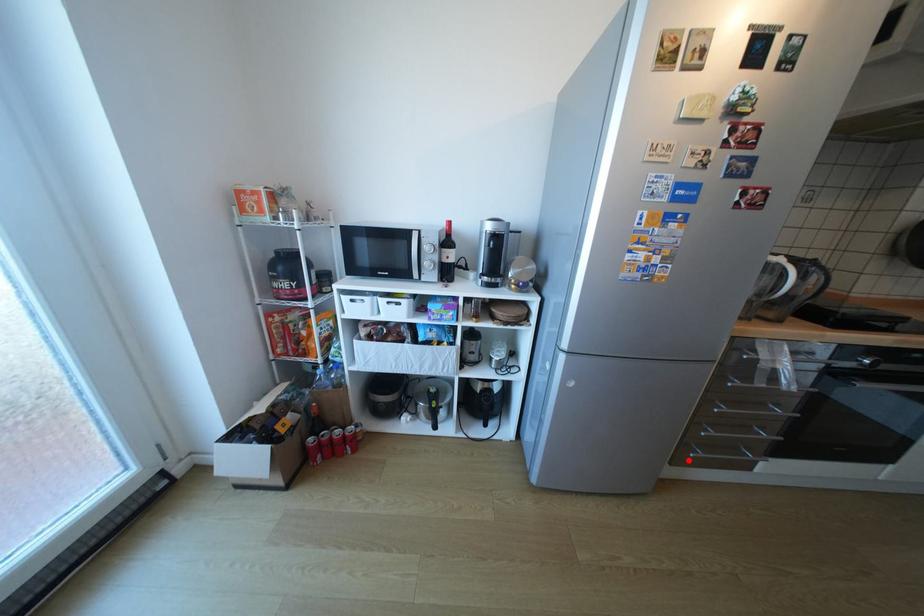
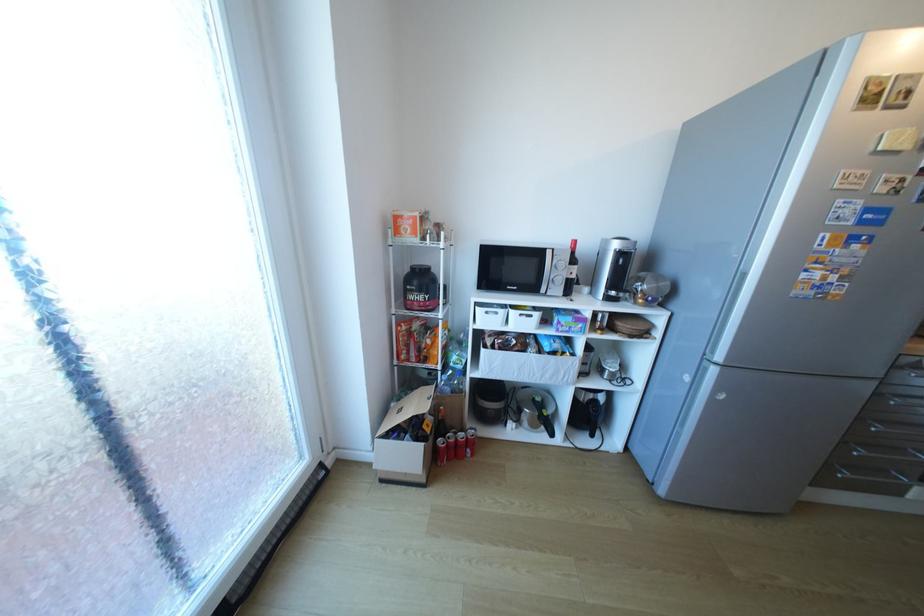
In the second image, find the point that corresponds to the highlighted location in the first image.

(834, 480)